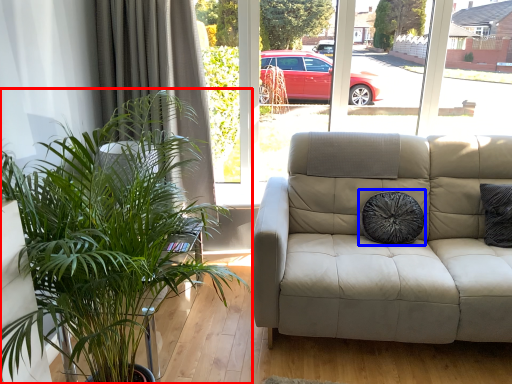
Question: Which point is closer to the camera, houseplant (highlighted by a red box) or pillow (highlighted by a blue box)?

Choices:
 (A) houseplant
 (B) pillow

Answer: (A)